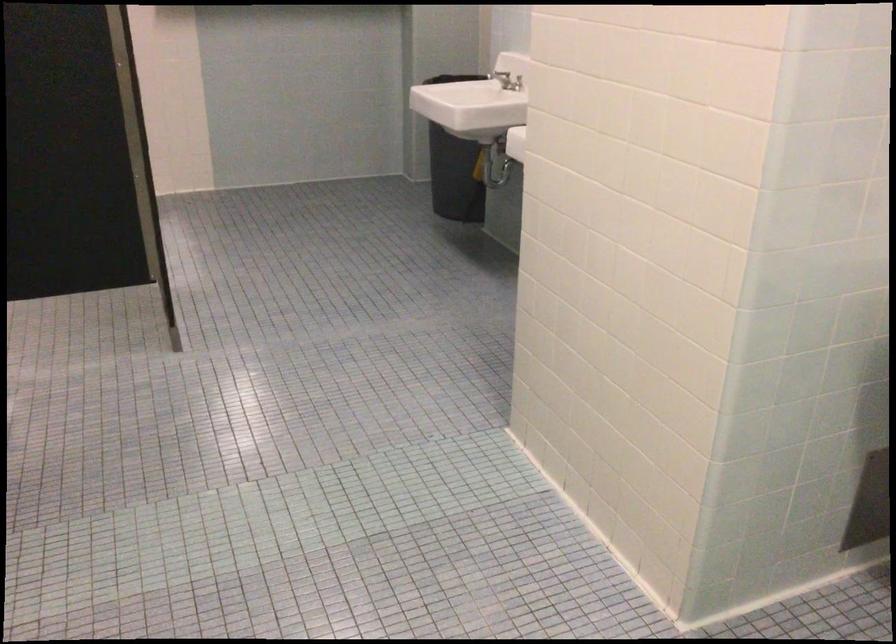
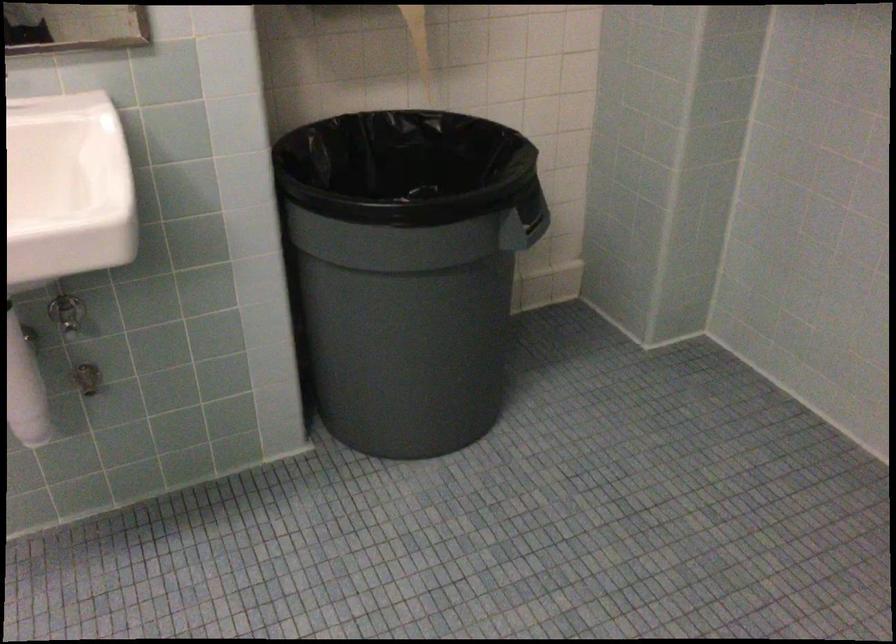
The images are taken continuously from a first-person perspective. In which direction is your viewpoint rotating?

The camera rotated toward right-down.